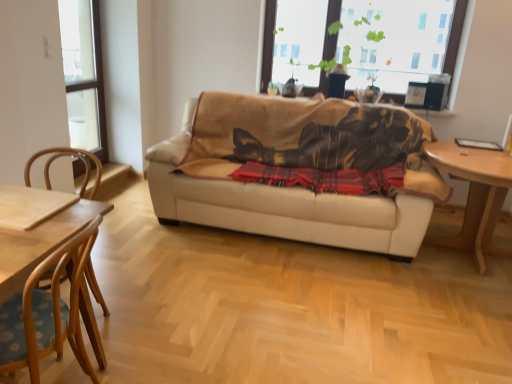
What are the coordinates of `empty space that is to the right of light wood chair at left, which is counted as the first chair, starting from the back` in the screenshot? It's located at (148, 324).